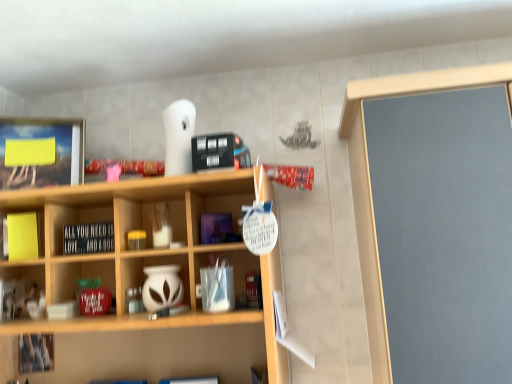
The width and height of the screenshot is (512, 384). What do you see at coordinates (88, 238) in the screenshot? I see `black matte signboard at center` at bounding box center [88, 238].

The height and width of the screenshot is (384, 512). What do you see at coordinates (23, 235) in the screenshot?
I see `yellow matte sticky notes at left, the 1th cabinet from the left` at bounding box center [23, 235].

I want to click on black matte signboard at center, so click(x=88, y=238).

Locate an element on the screen. The width and height of the screenshot is (512, 384). cabinet on the right side of black matte signboard at center is located at coordinates (156, 280).

Considering the positions of objects white matte vase at center, which is the second cabinet in top-to-bottom order, and black matte signboard at center in the image provided, who is in front, white matte vase at center, which is the second cabinet in top-to-bottom order, or black matte signboard at center?

white matte vase at center, which is the second cabinet in top-to-bottom order, is closer to the camera.

From a real-world perspective, is white matte vase at center, which is the second cabinet in left-to-right order, over black matte signboard at center?

Actually, white matte vase at center, which is the second cabinet in left-to-right order, is physically below black matte signboard at center in the real world.

Between black matte signboard at center and white matte vase at center, which is the second cabinet in left-to-right order, which one is positioned in front?

white matte vase at center, which is the second cabinet in left-to-right order, is closer to the camera.

Is point (70, 248) more distant than point (177, 291)?

Yes.

From the image's perspective, which object appears higher, black matte signboard at center or white matte vase at center, which is the second cabinet in top-to-bottom order?

black matte signboard at center appears higher in the image.

From a real-world perspective, is black matte signboard at center located higher than white matte vase at center, which is the second cabinet in left-to-right order?

Correct, in the physical world, black matte signboard at center is higher than white matte vase at center, which is the second cabinet in left-to-right order.

Considering the relative sizes of black matte signboard at center and yellow matte sticky notes at left, placed as the second cabinet when sorted from right to left, in the image provided, is black matte signboard at center thinner than yellow matte sticky notes at left, placed as the second cabinet when sorted from right to left,?

In fact, black matte signboard at center might be wider than yellow matte sticky notes at left, placed as the second cabinet when sorted from right to left.

Considering the points (84, 237) and (7, 253), which point is behind, point (84, 237) or point (7, 253)?

The point (7, 253) is behind.

Is yellow matte sticky notes at left, placed as the second cabinet when sorted from right to left, a part of black matte signboard at center?

No, yellow matte sticky notes at left, placed as the second cabinet when sorted from right to left, is not a part of black matte signboard at center.

The width and height of the screenshot is (512, 384). Find the location of `cabinet above the black matte signboard at center (from the image's perspective)`. cabinet above the black matte signboard at center (from the image's perspective) is located at coordinates (23, 235).

Is white matte vase at center, which is the 1th cabinet in right-to-left order, looking in the opposite direction of yellow matte sticky notes at left, the 1th cabinet from the left?

No, yellow matte sticky notes at left, the 1th cabinet from the left, is not at the back of white matte vase at center, which is the 1th cabinet in right-to-left order.

In the scene shown: Is white matte vase at center, which is the second cabinet in left-to-right order, far away from yellow matte sticky notes at left, which is counted as the 1th cabinet, starting from the top?

No, white matte vase at center, which is the second cabinet in left-to-right order, is not far away from yellow matte sticky notes at left, which is counted as the 1th cabinet, starting from the top.

From a real-world perspective, is white matte vase at center, which is the 1th cabinet in right-to-left order, physically above yellow matte sticky notes at left, the 1th cabinet from the left?

No, from a real-world perspective, white matte vase at center, which is the 1th cabinet in right-to-left order, is not on top of yellow matte sticky notes at left, the 1th cabinet from the left.

Could you tell me if yellow matte sticky notes at left, which is counted as the 1th cabinet, starting from the top, is turned towards black matte signboard at center?

No, yellow matte sticky notes at left, which is counted as the 1th cabinet, starting from the top, is not turned towards black matte signboard at center.

From a real-world perspective, is yellow matte sticky notes at left, the second cabinet positioned from the bottom, physically located above or below black matte signboard at center?

In terms of real-world spatial position, yellow matte sticky notes at left, the second cabinet positioned from the bottom, is above black matte signboard at center.

Considering the sizes of objects yellow matte sticky notes at left, placed as the second cabinet when sorted from right to left, and black matte signboard at center in the image provided, who is shorter, yellow matte sticky notes at left, placed as the second cabinet when sorted from right to left, or black matte signboard at center?

Standing shorter between the two is black matte signboard at center.

From the image's perspective, is yellow matte sticky notes at left, the second cabinet positioned from the bottom, above black matte signboard at center?

Yes, from the image's perspective, yellow matte sticky notes at left, the second cabinet positioned from the bottom, is on top of black matte signboard at center.

What's the angular difference between yellow matte sticky notes at left, the second cabinet positioned from the bottom, and white matte vase at center, which is the second cabinet in top-to-bottom order,'s facing directions?

17.7 degrees separate the facing orientations of yellow matte sticky notes at left, the second cabinet positioned from the bottom, and white matte vase at center, which is the second cabinet in top-to-bottom order.

Based on the photo, is yellow matte sticky notes at left, the second cabinet positioned from the bottom, aimed at white matte vase at center, which is the second cabinet in top-to-bottom order?

No, yellow matte sticky notes at left, the second cabinet positioned from the bottom, is not turned towards white matte vase at center, which is the second cabinet in top-to-bottom order.

At what (x,y) coordinates should I click in order to perform the action: click on cabinet behind the white matte vase at center, which is the second cabinet in left-to-right order. Please return your answer as a coordinate pair (x, y). The height and width of the screenshot is (384, 512). Looking at the image, I should click on (23, 235).

Is yellow matte sticky notes at left, the second cabinet positioned from the bottom, located outside white matte vase at center, which is the second cabinet in top-to-bottom order?

Indeed, yellow matte sticky notes at left, the second cabinet positioned from the bottom, is completely outside white matte vase at center, which is the second cabinet in top-to-bottom order.

The height and width of the screenshot is (384, 512). What are the coordinates of `book behind the white matte vase at center, which is the 1th cabinet in right-to-left order` in the screenshot? It's located at (88, 238).

The image size is (512, 384). I want to click on cabinet in front of the black matte signboard at center, so click(156, 280).

Which object lies nearer to the anchor point white matte vase at center, which is the 1th cabinet in bottom-to-top order, black matte signboard at center or yellow matte sticky notes at left, placed as the second cabinet when sorted from right to left?

black matte signboard at center is positioned closer to the anchor white matte vase at center, which is the 1th cabinet in bottom-to-top order.

Estimate the real-world distances between objects in this image. Which object is closer to black matte signboard at center, yellow matte sticky notes at left, the second cabinet positioned from the bottom, or white matte vase at center, which is the second cabinet in left-to-right order?

white matte vase at center, which is the second cabinet in left-to-right order, lies closer to black matte signboard at center than the other object.

Consider the image. Based on their spatial positions, is white matte vase at center, which is the second cabinet in left-to-right order, or black matte signboard at center closer to yellow matte sticky notes at left, the second cabinet positioned from the bottom?

black matte signboard at center is positioned closer to the anchor yellow matte sticky notes at left, the second cabinet positioned from the bottom.

Estimate the real-world distances between objects in this image. Which object is further from white matte vase at center, which is the 1th cabinet in right-to-left order, yellow matte sticky notes at left, which is counted as the 1th cabinet, starting from the top, or black matte signboard at center?

yellow matte sticky notes at left, which is counted as the 1th cabinet, starting from the top.

Based on their spatial positions, is white matte vase at center, which is the 1th cabinet in right-to-left order, or yellow matte sticky notes at left, placed as the second cabinet when sorted from right to left, closer to black matte signboard at center?

The object closer to black matte signboard at center is white matte vase at center, which is the 1th cabinet in right-to-left order.

Estimate the real-world distances between objects in this image. Which object is further from yellow matte sticky notes at left, the second cabinet positioned from the bottom, black matte signboard at center or white matte vase at center, which is the second cabinet in left-to-right order?

Among the two, white matte vase at center, which is the second cabinet in left-to-right order, is located further to yellow matte sticky notes at left, the second cabinet positioned from the bottom.

You are a GUI agent. You are given a task and a screenshot of the screen. Output one action in this format:
    pyautogui.click(x=<x>, y=<y>)
    Task: Click on the book between yellow matte sticky notes at left, the 1th cabinet from the left, and white matte vase at center, which is the 1th cabinet in right-to-left order
    This screenshot has width=512, height=384.
    Given the screenshot: What is the action you would take?
    pyautogui.click(x=88, y=238)